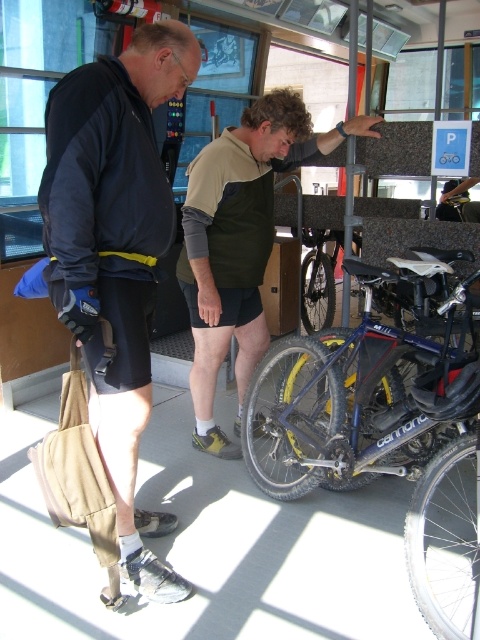
Who is lower down, matte black jacket at left or blue metallic bicycle at center?

blue metallic bicycle at center is lower down.

Can you confirm if matte black jacket at left is positioned to the right of blue metallic bicycle at center?

Incorrect, matte black jacket at left is not on the right side of blue metallic bicycle at center.

Is point (169, 577) positioned after point (425, 417)?

No, it is not.

Identify the location of matte black jacket at left. (116, 253).

Is green fabric apron at center closer to camera compared to shiny metallic bicycle at center?

Yes, it is.

Does point (255, 228) come in front of point (307, 259)?

Yes, it is.

Identify the location of green fabric apron at center. The image size is (480, 640). (240, 241).

Which is behind, point (373, 328) or point (312, 330)?

The point (312, 330) is more distant.

Which is above, blue metallic bicycle at center or shiny metallic bicycle at center?

shiny metallic bicycle at center is above.

The height and width of the screenshot is (640, 480). Describe the element at coordinates (365, 387) in the screenshot. I see `blue metallic bicycle at center` at that location.

Locate an element on the screen. The width and height of the screenshot is (480, 640). blue metallic bicycle at center is located at coordinates (365, 387).